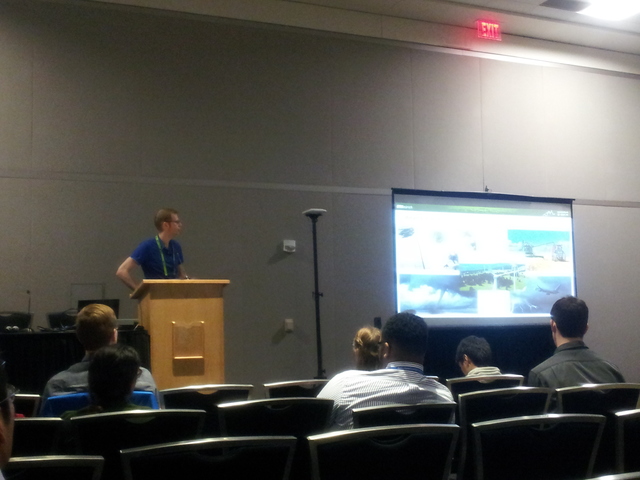
Locate an element on the screen. lamp is located at coordinates (310, 213).